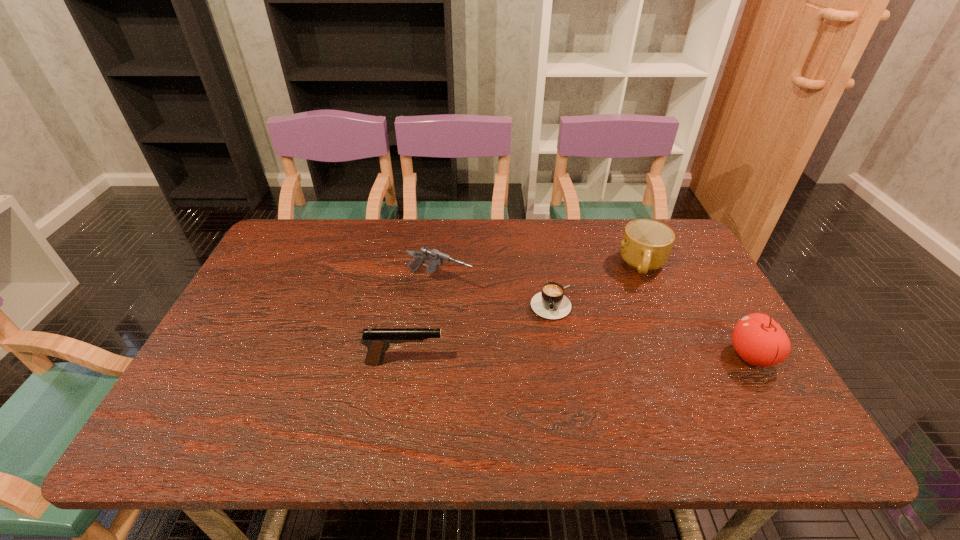
Where is `free spot between the apple and the shortest object`? The width and height of the screenshot is (960, 540). free spot between the apple and the shortest object is located at coordinates (652, 329).

The width and height of the screenshot is (960, 540). Identify the location of vacant region between the rightmost object and the gun. (595, 319).

Locate an element on the screen. This screenshot has width=960, height=540. unoccupied position between the rightmost object and the cappuccino is located at coordinates (652, 329).

I want to click on free space between the second object from right to left and the gun, so (541, 274).

Image resolution: width=960 pixels, height=540 pixels. In order to click on empty space that is in between the rightmost object and the gun in this screenshot , I will do `click(595, 319)`.

This screenshot has width=960, height=540. Find the location of `object that is the closest to the third object from left to right`. object that is the closest to the third object from left to right is located at coordinates tap(435, 258).

Image resolution: width=960 pixels, height=540 pixels. Find the location of `object that ranks as the fourth closest to the gun`. object that ranks as the fourth closest to the gun is located at coordinates click(x=758, y=339).

Locate an element on the screen. This screenshot has width=960, height=540. vacant space that satisfies the following two spatial constraints: 1. on the front side of the gun; 2. on the left side of the apple is located at coordinates (432, 356).